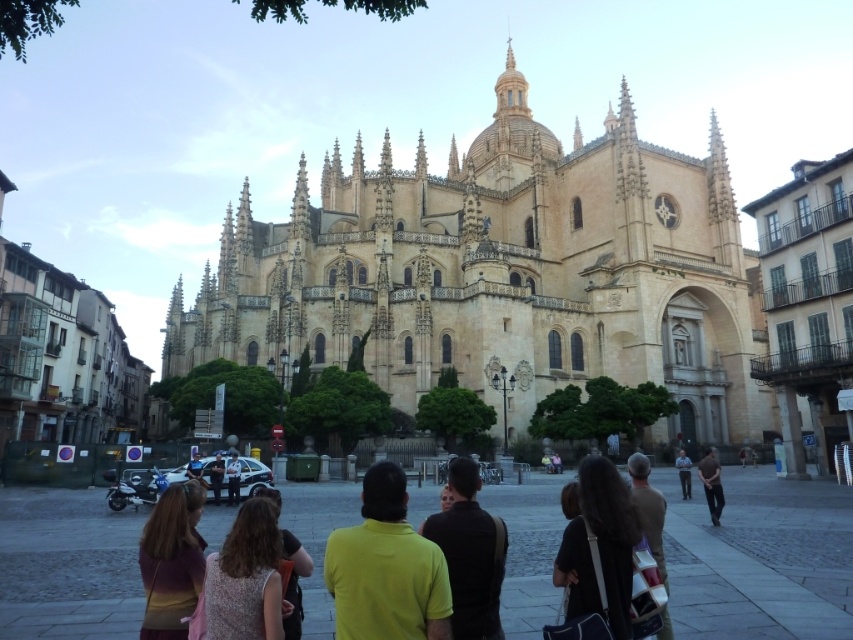
Question: Based on their relative distances, which object is nearer to the black shirt at center?

Choices:
 (A) shiny brown hair at center
 (B) dark blue uniform at center

Answer: (A)

Question: Which of the following is the farthest from the observer?

Choices:
 (A) yellow matte shirt at center
 (B) dark blue uniform at center
 (C) black fabric bag at center
 (D) shiny brown hair at center

Answer: (B)

Question: Is dark brown leather jacket at center smaller than dark blue uniform at center?

Choices:
 (A) yes
 (B) no

Answer: (B)

Question: Which of the following is the closest to the observer?

Choices:
 (A) (329, 540)
 (B) (469, 522)
 (C) (198, 632)
 (D) (231, 452)

Answer: (C)

Question: Does yellow matte shirt at center have a lesser width compared to dark blue uniform at center?

Choices:
 (A) yes
 (B) no

Answer: (A)

Question: Is golden stone church at center wider than floral fabric dress at center?

Choices:
 (A) no
 (B) yes

Answer: (B)